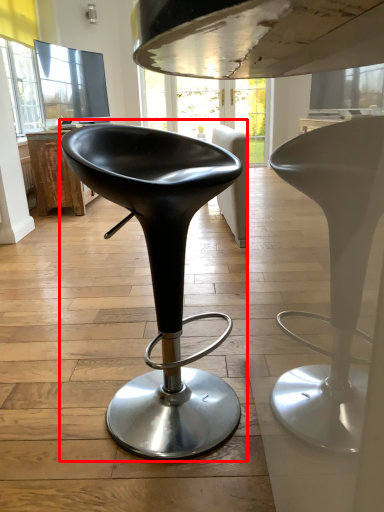
Question: From the image's perspective, what is the correct spatial relationship of chair (annotated by the red box) in relation to table?

Choices:
 (A) above
 (B) below

Answer: (B)